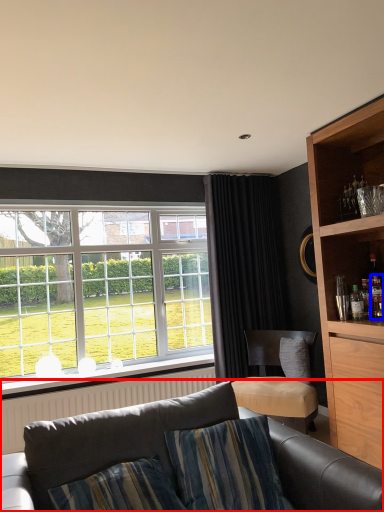
Question: Which object appears farthest to the camera in this image, studio couch (highlighted by a red box) or bottle (highlighted by a blue box)?

Choices:
 (A) studio couch
 (B) bottle

Answer: (B)